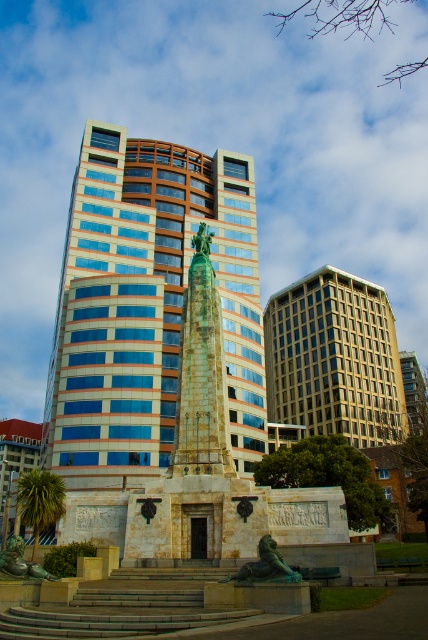
You are a city planner who wants to install a new public art piece in the plaza in front of the blue glass building at center. The art piece requires a minimum of 200 feet of space between it and the building to ensure visibility and safety. Based on the scene description, will the available space meet this requirement?

The blue glass building at center is 228.94 feet away from the viewer. Since the required minimum distance is 200 feet, the available space meets the requirement as 228.94 feet exceeds the 200 feet threshold.

You are an architect reviewing a city model and notice the blue glass building at center and the beige glass building at center. Which one appears to be in front?

The blue glass building at center is positioned over beige glass building at center, so it appears in front.

You are a city planner assessing the view of the beige glass building at center and the green patina bronze statue at center from the nearby park. Which structure would appear larger in the cityscape when viewed from a distance?

The beige glass building at center is taller than the green patina bronze statue at center, so it would appear larger in the cityscape when viewed from a distance.